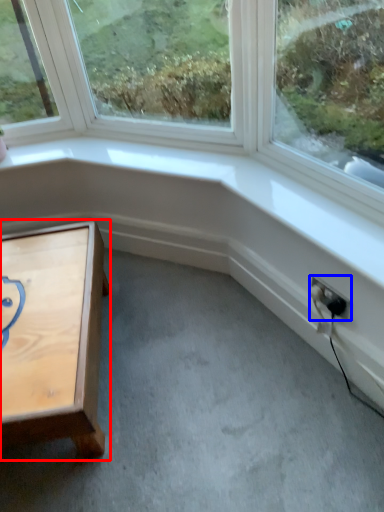
Question: Which object appears closest to the camera in this image, table (highlighted by a red box) or electric outlet (highlighted by a blue box)?

Choices:
 (A) table
 (B) electric outlet

Answer: (A)